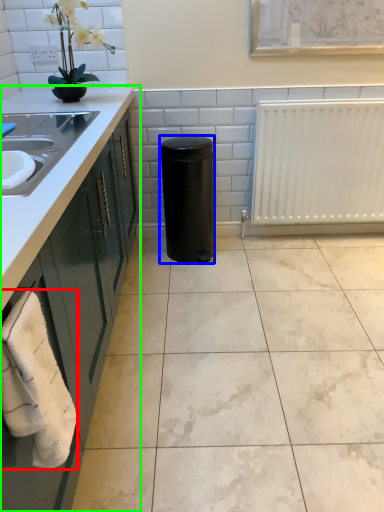
Question: Estimate the real-world distances between objects in this image. Which object is closer to bath towel (highlighted by a red box), appliance (highlighted by a blue box) or countertop (highlighted by a green box)?

Choices:
 (A) appliance
 (B) countertop

Answer: (B)